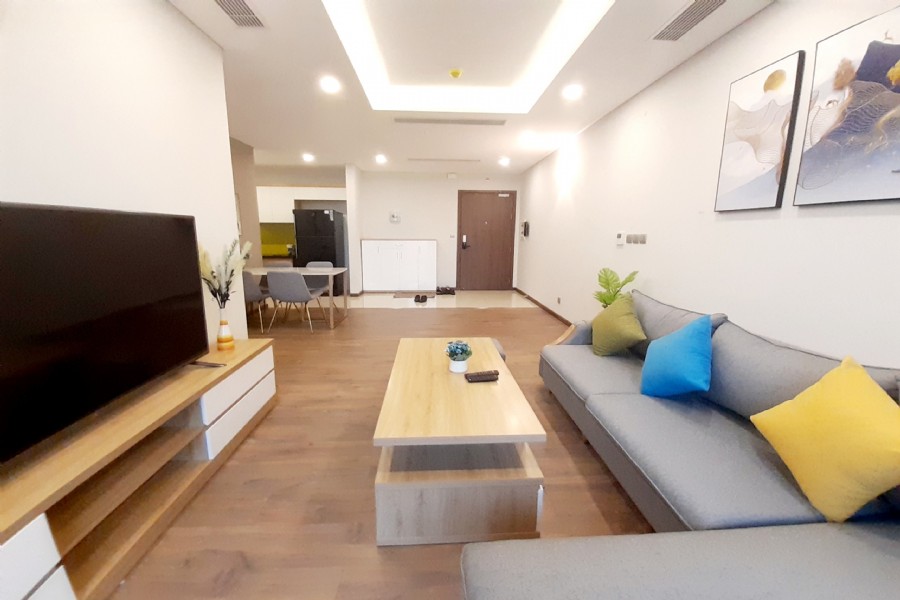
Where is `center shelf of television stand`? center shelf of television stand is located at coordinates (122, 490).